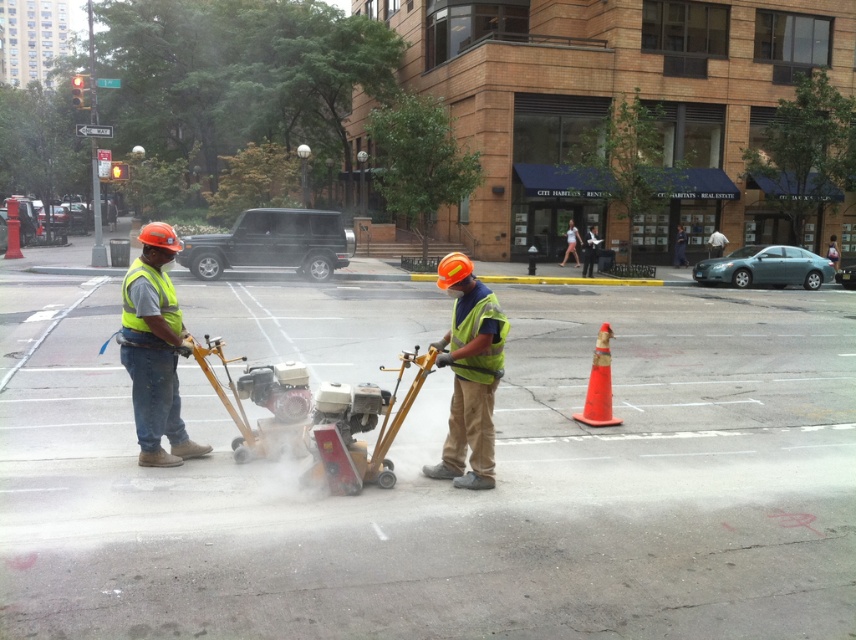
You are a pedestrian crossing the street and notice two workers in reflective vests. You see the reflective yellow vest at center and the yellow reflective safety vest at center. Which vest is closer to you?

The reflective yellow vest at center is 3.30 inches away from the yellow reflective safety vest at center, so the reflective yellow vest at center is closer to you.